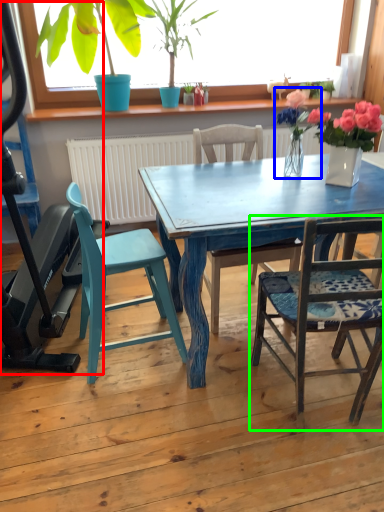
Question: Which object is the farthest from baby carriage (highlighted by a red box)? Choose among these: floral arrangement (highlighted by a blue box) or chair (highlighted by a green box).

Choices:
 (A) floral arrangement
 (B) chair

Answer: (A)